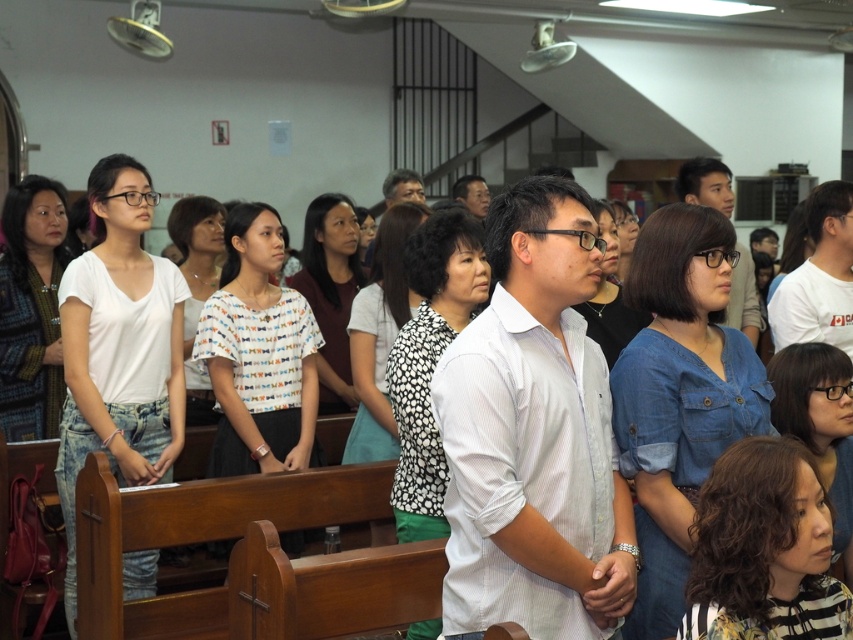
Consider the image. You are standing at the back of the church and want to hand a note to the person wearing the white striped shirt at center and the matte white shirt at center. Which one can you reach first without moving from your spot?

The white striped shirt at center is closer to the viewer than the matte white shirt at center, so you can reach the white striped shirt at center first without moving from your current position.

You are standing at the back of the church and want to hand a note to the person wearing the matte white shirt at center and the matte black shirt at center. Which shirt should you target first if you want to reach the closest person?

The matte white shirt at center is closer to the viewer than the matte black shirt at center, so you should target the person wearing the matte white shirt at center first.